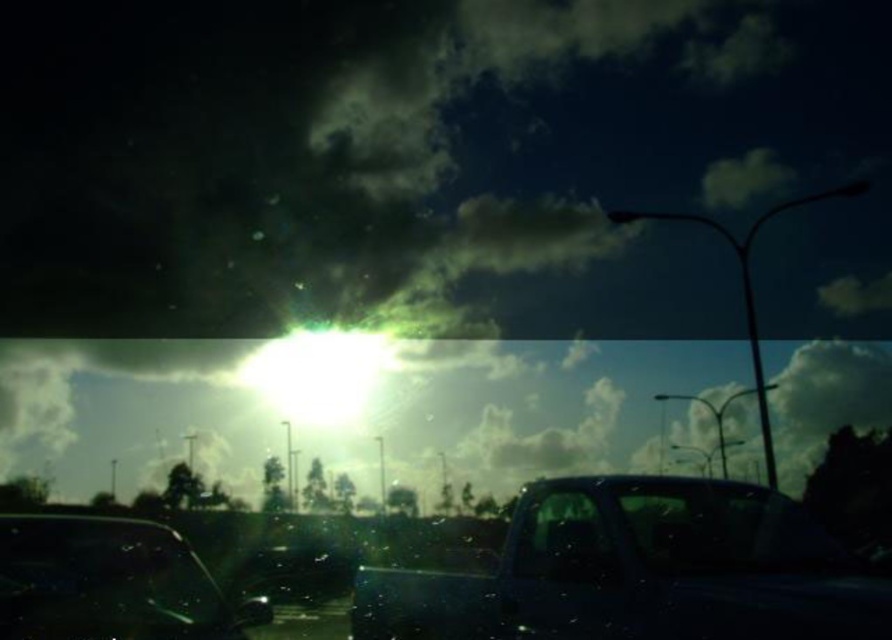
Question: Does shiny black truck at center have a lesser width compared to bright metallic sun at center?

Choices:
 (A) yes
 (B) no

Answer: (A)

Question: Can you confirm if shiny black truck at center is positioned to the left of transparent glass car at lower left?

Choices:
 (A) no
 (B) yes

Answer: (A)

Question: Which of the following is the closest to the observer?

Choices:
 (A) (527, 589)
 (B) (544, 579)
 (C) (326, 413)

Answer: (B)

Question: Can you confirm if transparent glass car at lower left is wider than bright metallic sun at center?

Choices:
 (A) yes
 (B) no

Answer: (B)

Question: Which is farther from the transparent glass car at lower left?

Choices:
 (A) bright metallic sun at center
 (B) transparent glass car window at center

Answer: (A)

Question: Which object is farther from the camera taking this photo?

Choices:
 (A) bright metallic sun at center
 (B) transparent glass car window at center

Answer: (A)